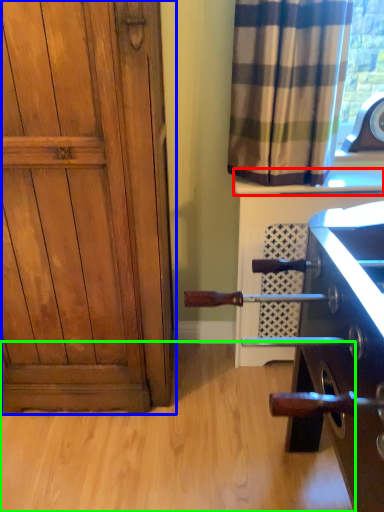
Question: Estimate the real-world distances between objects in this image. Which object is farther from window sill (highlighted by a red box), door (highlighted by a blue box) or plain (highlighted by a green box)?

Choices:
 (A) door
 (B) plain

Answer: (B)